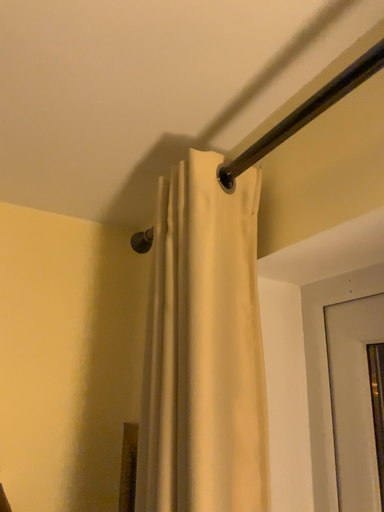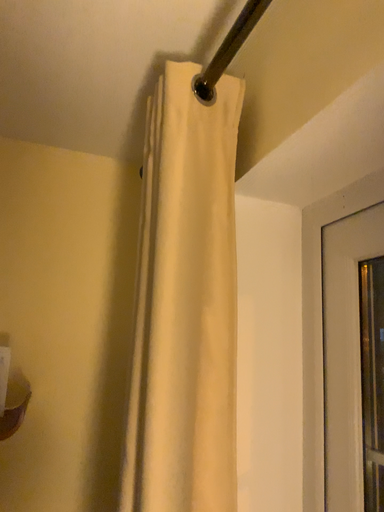
Question: How did the camera likely rotate when shooting the video?

Choices:
 (A) rotated left
 (B) rotated right

Answer: (A)